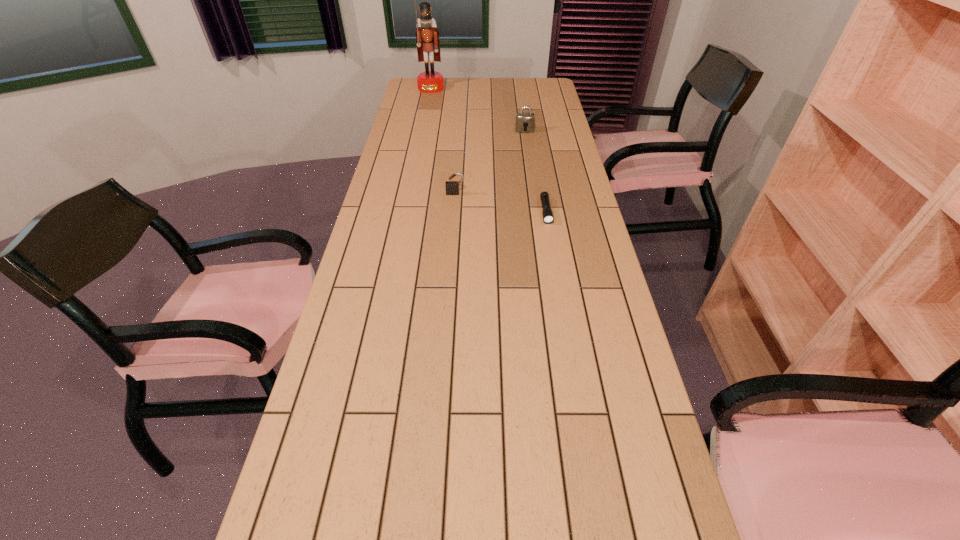
Find the location of a particular element. nutcracker is located at coordinates (427, 35).

Where is `the tallest object`? The image size is (960, 540). the tallest object is located at coordinates (427, 35).

Where is `the taller padlock`? The height and width of the screenshot is (540, 960). the taller padlock is located at coordinates point(525,121).

Image resolution: width=960 pixels, height=540 pixels. Identify the location of the right padlock. point(525,121).

Where is `the shorter padlock`? The image size is (960, 540). the shorter padlock is located at coordinates (452, 187).

This screenshot has width=960, height=540. In order to click on the left padlock in this screenshot , I will do `click(452, 187)`.

Where is `the nearest object`? the nearest object is located at coordinates (548, 218).

Locate an element on the screen. flashlight is located at coordinates (548, 218).

Find the location of a particular element. The image size is (960, 540). vacant region located 0.080m on the front-facing side of the leftmost object is located at coordinates (428, 100).

This screenshot has height=540, width=960. Find the location of `vacant area situated at the front of the third nearest object near the keyhole`. vacant area situated at the front of the third nearest object near the keyhole is located at coordinates [531, 171].